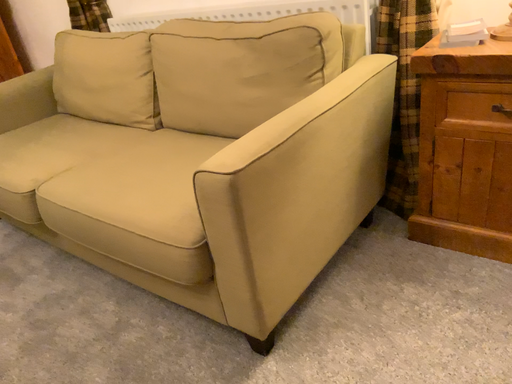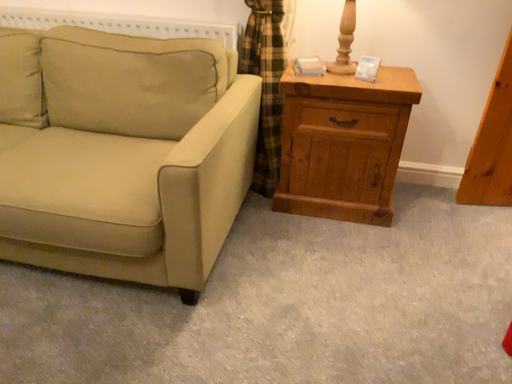
Question: Which way did the camera rotate in the video?

Choices:
 (A) rotated right
 (B) rotated left

Answer: (A)